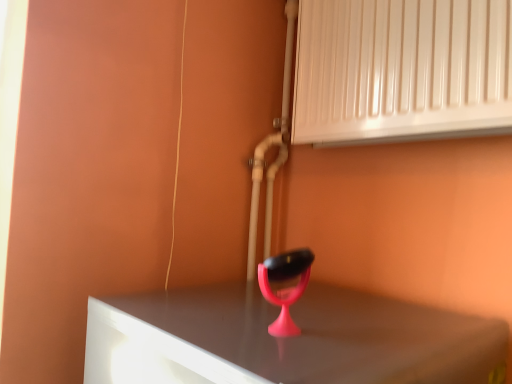
Question: Is pink plastic table lamp at center positioned before white glossy radiator at upper right?

Choices:
 (A) no
 (B) yes

Answer: (B)

Question: From a real-world perspective, does pink plastic table lamp at center sit lower than white glossy radiator at upper right?

Choices:
 (A) yes
 (B) no

Answer: (A)

Question: Considering the relative positions of pink plastic table lamp at center and white glossy radiator at upper right in the image provided, is pink plastic table lamp at center to the left of white glossy radiator at upper right from the viewer's perspective?

Choices:
 (A) no
 (B) yes

Answer: (B)

Question: Does pink plastic table lamp at center have a lesser width compared to white glossy radiator at upper right?

Choices:
 (A) no
 (B) yes

Answer: (B)

Question: Does pink plastic table lamp at center appear on the right side of white glossy radiator at upper right?

Choices:
 (A) yes
 (B) no

Answer: (B)

Question: Is pink plastic table lamp at center wider than white glossy radiator at upper right?

Choices:
 (A) no
 (B) yes

Answer: (A)

Question: Is white glossy radiator at upper right oriented towards pink plastic table lamp at center?

Choices:
 (A) no
 (B) yes

Answer: (A)

Question: Considering the relative sizes of white glossy radiator at upper right and pink plastic table lamp at center in the image provided, is white glossy radiator at upper right wider than pink plastic table lamp at center?

Choices:
 (A) no
 (B) yes

Answer: (B)

Question: Can you confirm if white glossy radiator at upper right is smaller than pink plastic table lamp at center?

Choices:
 (A) yes
 (B) no

Answer: (B)

Question: Would you say white glossy radiator at upper right is outside pink plastic table lamp at center?

Choices:
 (A) no
 (B) yes

Answer: (B)

Question: Is pink plastic table lamp at center surrounded by white glossy radiator at upper right?

Choices:
 (A) yes
 (B) no

Answer: (B)

Question: Are white glossy radiator at upper right and pink plastic table lamp at center beside each other?

Choices:
 (A) no
 (B) yes

Answer: (A)

Question: From a real-world perspective, is pink plastic table lamp at center above or below white glossy radiator at upper right?

Choices:
 (A) below
 (B) above

Answer: (A)